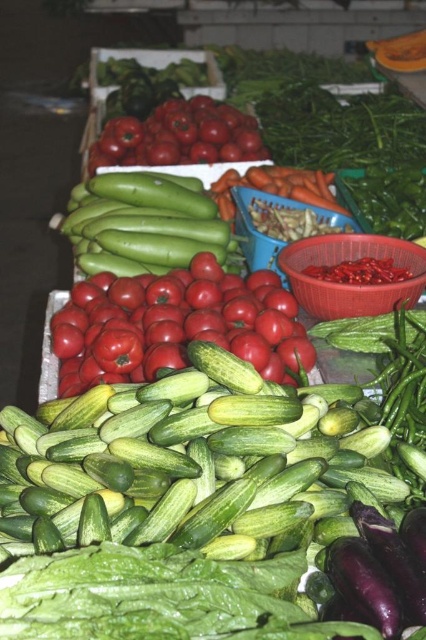
You are a customer at the market stall and want to buy both the shiny red tomatoes at center and the orange smooth carrot at center. Which one is located higher up?

The orange smooth carrot at center is higher up since the shiny red tomatoes at center are positioned below it.

You are a customer at the market stall looking at the vegetables. There are two points marked in the scene. One is at coordinate point (196, 356) and the other is at coordinate point (299, 192). Which point is closer to you?

Point (196, 356) is closer to the camera than point (299, 192).

Based on the photo, you are a photographer standing at the market stall. You want to take a closeup photo of the green smooth cucumber at center, but your lens can only focus on objects within 30 inches. Can you take the photo without moving closer?

The distance between the green smooth cucumber at center and the camera is 33.18 inches, which is beyond the 30 inches focus range. Therefore, you cannot take the photo without moving closer.